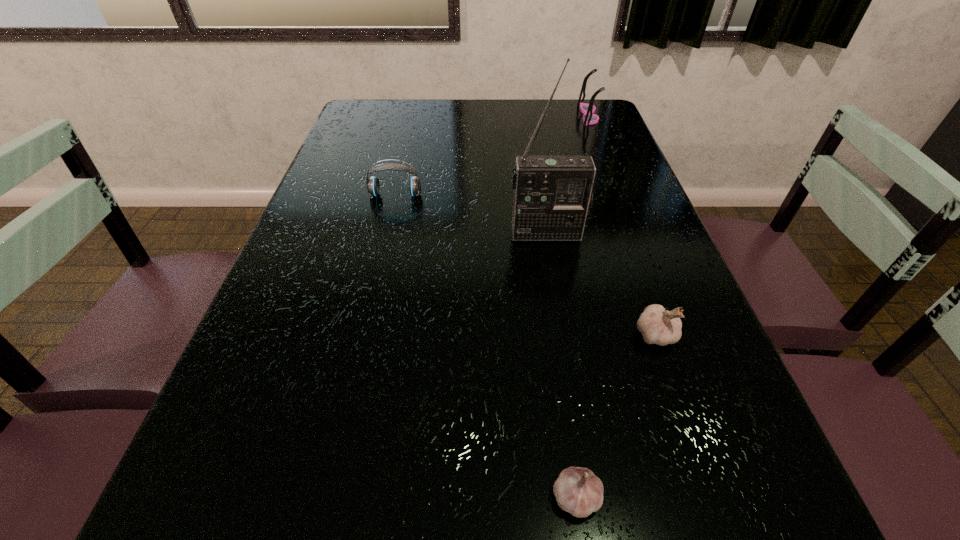
I want to click on radio receiver, so click(x=552, y=194).

Where is `the third farthest object`? the third farthest object is located at coordinates (552, 194).

The image size is (960, 540). What are the coordinates of `the farthest object` in the screenshot? It's located at (588, 109).

Where is `spectacles`? spectacles is located at coordinates (588, 109).

At what (x,y) coordinates should I click in order to perform the action: click on the fourth nearest object. Please return your answer as a coordinate pair (x, y). This screenshot has height=540, width=960. Looking at the image, I should click on (373, 186).

Where is `headset`? This screenshot has height=540, width=960. headset is located at coordinates (373, 186).

The width and height of the screenshot is (960, 540). In order to click on the farther garlic in this screenshot , I will do `click(657, 326)`.

I want to click on the right garlic, so click(x=657, y=326).

The height and width of the screenshot is (540, 960). Identify the location of the shortest object. (578, 491).

The height and width of the screenshot is (540, 960). I want to click on the left garlic, so [578, 491].